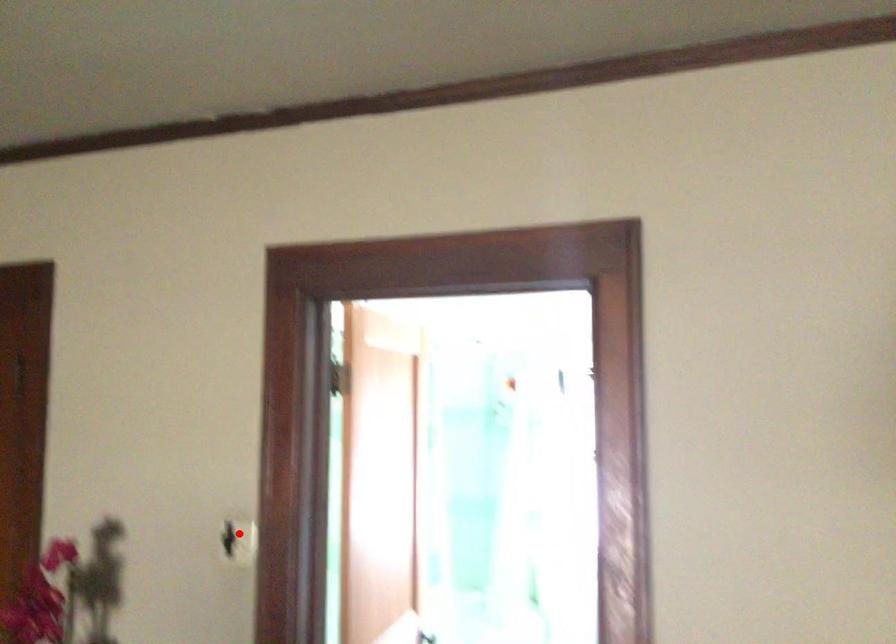
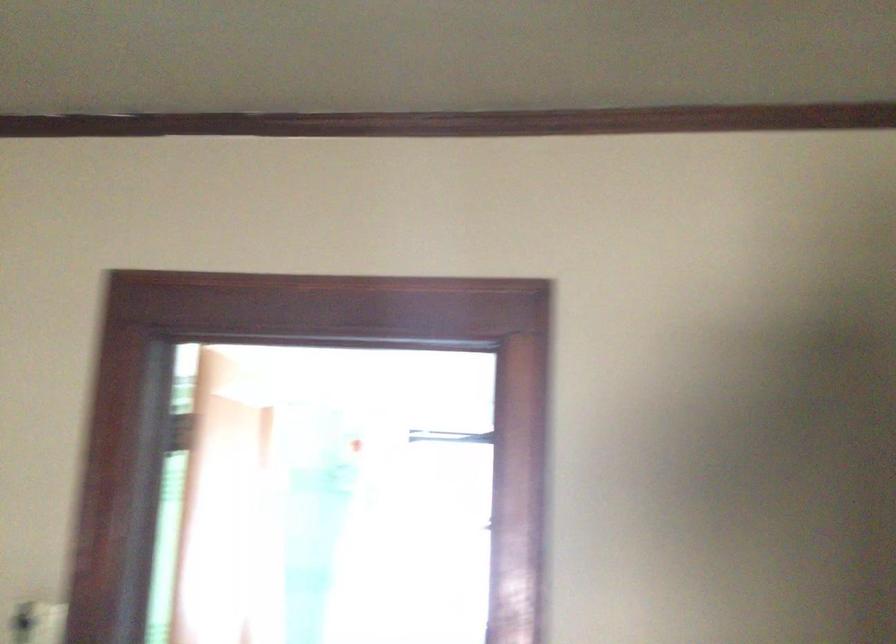
Question: I am providing you with two images of the same scene from different viewpoints. Given a red point in image1, look at the same physical point in image2. Is it:

Choices:
 (A) Closer to the viewpoint
 (B) Farther from the viewpoint

Answer: (A)